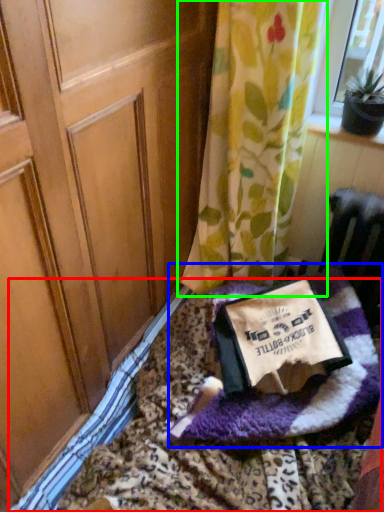
Question: Considering the real-world distances, which object is closest to bedding (highlighted by a red box)? blanket (highlighted by a blue box) or curtain (highlighted by a green box).

Choices:
 (A) blanket
 (B) curtain

Answer: (A)